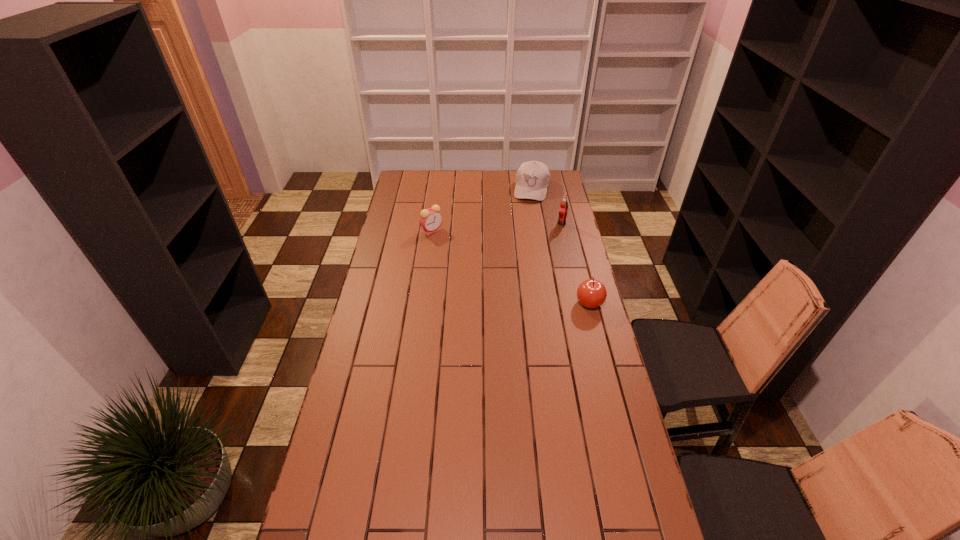
You are a GUI agent. You are given a task and a screenshot of the screen. Output one action in this format:
    pyautogui.click(x=<x>, y=<y>)
    Task: Click on the vacant region between the soda bottle and the apple
    
    Given the screenshot: What is the action you would take?
    pyautogui.click(x=575, y=264)

The width and height of the screenshot is (960, 540). I want to click on vacant area that lies between the nearest object and the alarm clock, so (x=511, y=267).

You are a GUI agent. You are given a task and a screenshot of the screen. Output one action in this format:
    pyautogui.click(x=<x>, y=<y>)
    Task: Click on the vacant area that lies between the farthest object and the apple
    
    Given the screenshot: What is the action you would take?
    pyautogui.click(x=561, y=246)

The height and width of the screenshot is (540, 960). I want to click on vacant area that lies between the tallest object and the alarm clock, so click(x=496, y=227).

This screenshot has width=960, height=540. I want to click on empty location between the leftmost object and the farthest object, so click(x=482, y=210).

The image size is (960, 540). Find the location of `vacant space in between the farthest object and the apple`. vacant space in between the farthest object and the apple is located at coordinates (561, 246).

Locate an element on the screen. The width and height of the screenshot is (960, 540). vacant space that's between the baseball cap and the leftmost object is located at coordinates (482, 210).

Find the location of a particular element. The height and width of the screenshot is (540, 960). free space between the farthest object and the tallest object is located at coordinates (546, 206).

Image resolution: width=960 pixels, height=540 pixels. Find the location of `vacant area that lies between the tallest object and the alarm clock`. vacant area that lies between the tallest object and the alarm clock is located at coordinates tap(496, 227).

Identify the location of free space between the leftmost object and the apple. click(511, 267).